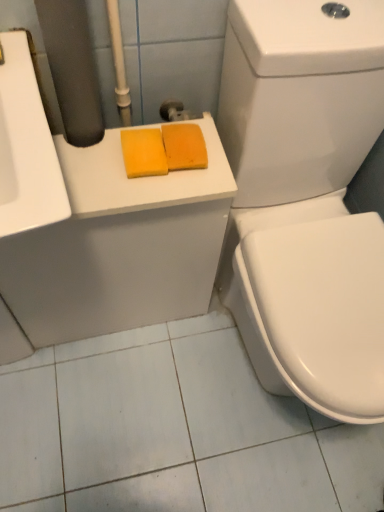
Question: Considering the relative sizes of yellow sponge at center, the 2th soap in the right-to-left sequence, and white glossy toilet at right in the image provided, is yellow sponge at center, the 2th soap in the right-to-left sequence, taller than white glossy toilet at right?

Choices:
 (A) yes
 (B) no

Answer: (B)

Question: Does yellow sponge at center, the 2th soap in the right-to-left sequence, have a lesser height compared to white glossy toilet at right?

Choices:
 (A) yes
 (B) no

Answer: (A)

Question: Does yellow sponge at center, which is the first soap in left-to-right order, lie in front of white glossy toilet at right?

Choices:
 (A) yes
 (B) no

Answer: (B)

Question: Could white glossy toilet at right be considered to be inside yellow sponge at center, which is the first soap in left-to-right order?

Choices:
 (A) yes
 (B) no

Answer: (B)

Question: Is yellow sponge at center, the 2th soap in the right-to-left sequence, at the left side of white glossy toilet at right?

Choices:
 (A) yes
 (B) no

Answer: (A)

Question: In the image, is yellow sponge at upper left positioned in front of or behind yellow sponge at center, the 2th soap in the right-to-left sequence?

Choices:
 (A) behind
 (B) front

Answer: (B)

Question: Is yellow sponge at upper left taller or shorter than yellow sponge at center, which is the first soap in left-to-right order?

Choices:
 (A) tall
 (B) short

Answer: (A)

Question: Is point (218, 222) positioned closer to the camera than point (130, 156)?

Choices:
 (A) farther
 (B) closer

Answer: (A)

Question: Looking at the image, does yellow sponge at upper left seem bigger or smaller compared to yellow sponge at center, the 2th soap in the right-to-left sequence?

Choices:
 (A) big
 (B) small

Answer: (A)

Question: Looking at the image, does orange sponge at upper center, acting as the second soap starting from the left, seem bigger or smaller compared to yellow sponge at upper left?

Choices:
 (A) big
 (B) small

Answer: (B)

Question: Is orange sponge at upper center, acting as the second soap starting from the left, inside the boundaries of yellow sponge at upper left, or outside?

Choices:
 (A) inside
 (B) outside

Answer: (B)

Question: Is orange sponge at upper center, acting as the second soap starting from the left, taller or shorter than yellow sponge at upper left?

Choices:
 (A) tall
 (B) short

Answer: (B)

Question: Considering the positions of point (177, 152) and point (162, 317), is point (177, 152) closer or farther from the camera than point (162, 317)?

Choices:
 (A) farther
 (B) closer

Answer: (B)

Question: Considering the positions of point (66, 310) and point (228, 82), is point (66, 310) closer or farther from the camera than point (228, 82)?

Choices:
 (A) closer
 (B) farther

Answer: (B)

Question: Relative to white glossy toilet at right, is yellow sponge at upper left in front or behind?

Choices:
 (A) front
 (B) behind

Answer: (B)